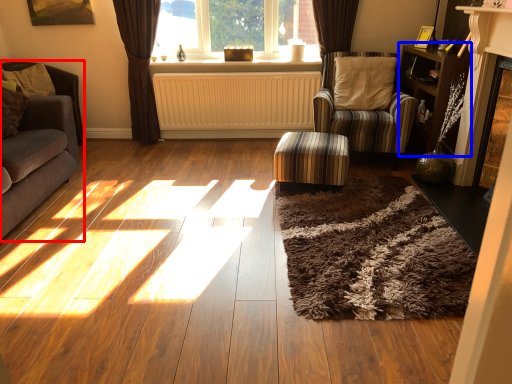
Question: Which object is closer to the camera taking this photo, studio couch (highlighted by a red box) or bookshelf (highlighted by a blue box)?

Choices:
 (A) studio couch
 (B) bookshelf

Answer: (A)